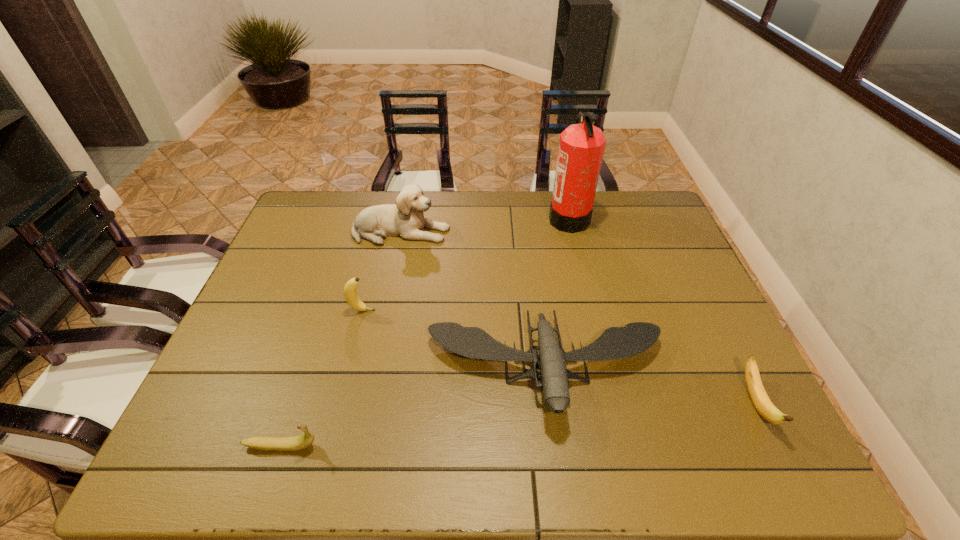
Image resolution: width=960 pixels, height=540 pixels. I want to click on vacant space situated on the front side of the tallest object, so click(x=520, y=218).

Where is `vacant region located on the front-facing side of the puppy`? vacant region located on the front-facing side of the puppy is located at coordinates (525, 232).

The width and height of the screenshot is (960, 540). I want to click on free space located from the stem of the tallest banana, so click(x=429, y=310).

This screenshot has height=540, width=960. What are the coordinates of `vacant space located at the stem of the nearest banana` in the screenshot? It's located at (459, 446).

Where is `free region located at the stem of the rightmost banana`? The width and height of the screenshot is (960, 540). free region located at the stem of the rightmost banana is located at coordinates (790, 472).

Locate an element on the screen. fire extinguisher that is positioned at the far edge is located at coordinates click(x=581, y=148).

Identify the location of puppy positioned at the far edge. (405, 219).

Where is `drone present at the near edge`? This screenshot has height=540, width=960. drone present at the near edge is located at coordinates (615, 342).

Where is `object that is at the left edge`? The image size is (960, 540). object that is at the left edge is located at coordinates (301, 442).

Where is `object located in the right edge section of the desktop`? The image size is (960, 540). object located in the right edge section of the desktop is located at coordinates (759, 397).